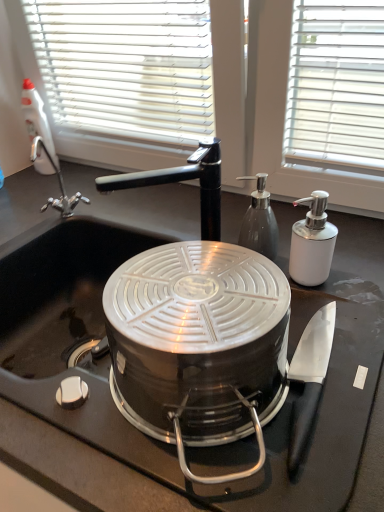
This screenshot has height=512, width=384. Find the location of `free space in front of white glossy soap dispenser at right, the first kitchen appliance positioned from the right`. free space in front of white glossy soap dispenser at right, the first kitchen appliance positioned from the right is located at coordinates (346, 334).